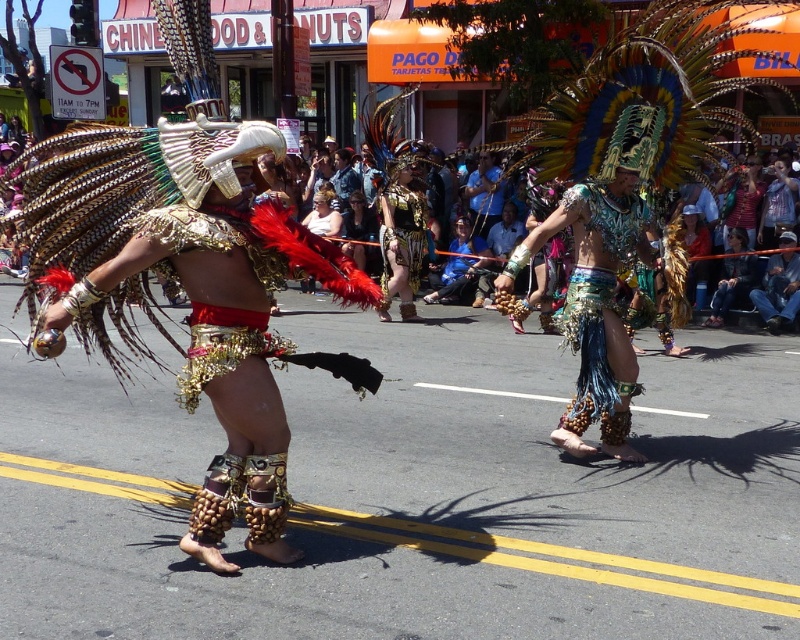
You are a photographer trying to capture a clear shot of both the shiny metallic headdress at center and the metallic gold armor at center. Since you want to focus on the headdress first, which object should you adjust your camera to focus on first based on their positions?

The shiny metallic headdress at center is located below the metallic gold armor at center, so you should focus on the metallic gold armor at center first as it is higher up and closer to the camera.

You are a photographer trying to capture a clear shot of both the shiny gold feathers at center and the blue metallic skirt at center. Since you can only focus on one object at a time, which one should you focus on first to ensure the other remains in the background?

You should focus on the shiny gold feathers at center first because it is located below the blue metallic skirt at center, so adjusting focus to the lower object will keep the upper one in the background.

You are a photographer standing at the camera position. You want to capture a photo of the shiny metallic headdress at center without any obstructions. The camera has a focal length of 50mm. What is the minimum distance you need to be from the shiny metallic headdress to ensure it fills the frame properly?

The shiny metallic headdress at center and camera are 5.31 meters apart. To ensure the headdress fills the frame with a 50mm lens, you should position yourself approximately 5.31 meters away, as that is the distance between the camera and the headdress.